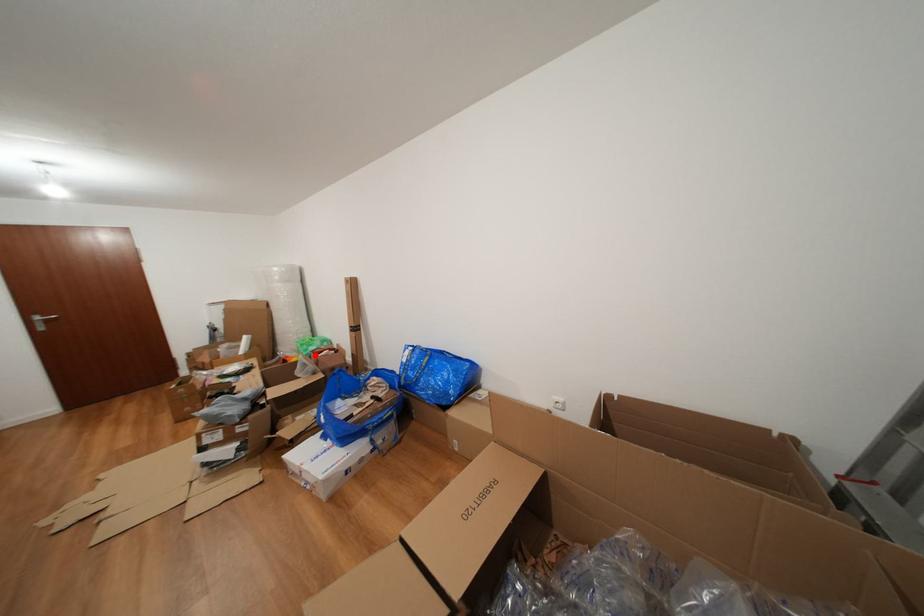
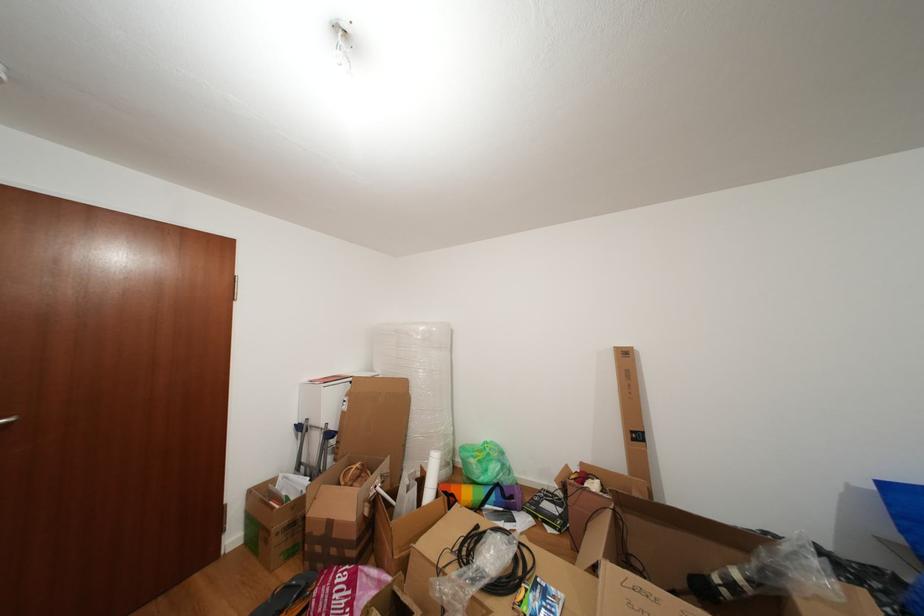
In the second image, find the point that corresponds to the highlighted location in the first image.

(494, 476)